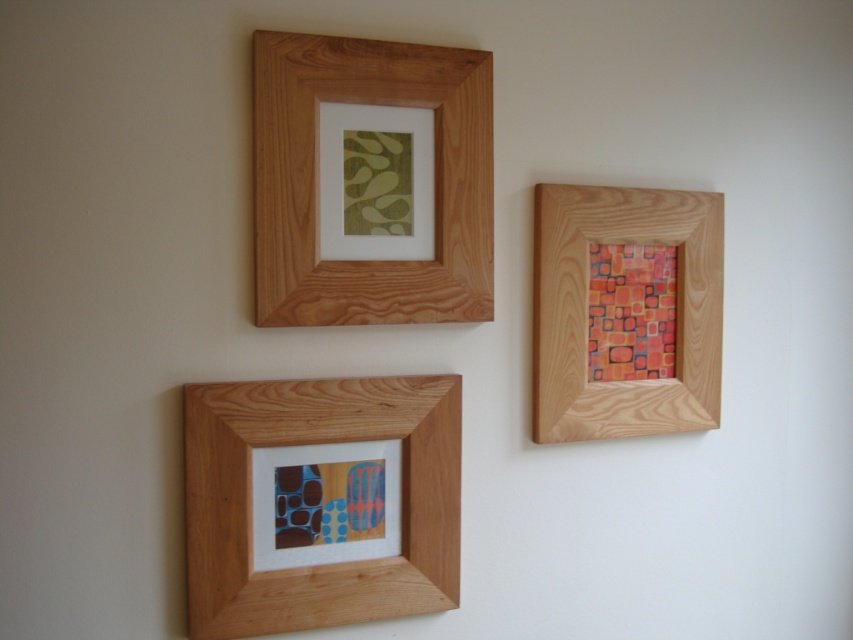
Question: Which point is farther to the camera?

Choices:
 (A) wooden frame at upper center
 (B) wooden frame at lower left

Answer: (A)

Question: Considering the relative positions of wooden frame at upper left and wooden frame at upper right in the image provided, where is wooden frame at upper left located with respect to wooden frame at upper right?

Choices:
 (A) left
 (B) right

Answer: (A)

Question: Which of the following is the farthest from the observer?

Choices:
 (A) (697, 378)
 (B) (310, 196)
 (C) (402, 204)

Answer: (A)

Question: Does wooden frame at lower left have a lesser width compared to wooden frame at upper right?

Choices:
 (A) yes
 (B) no

Answer: (B)

Question: Is wooden frame at upper left wider than multicolored painted squares at upper right?

Choices:
 (A) no
 (B) yes

Answer: (B)

Question: Estimate the real-world distances between objects in this image. Which object is farther from the wooden frame at lower left?

Choices:
 (A) wooden frame at upper right
 (B) wooden frame at upper center
 (C) multicolored painted squares at upper right

Answer: (C)